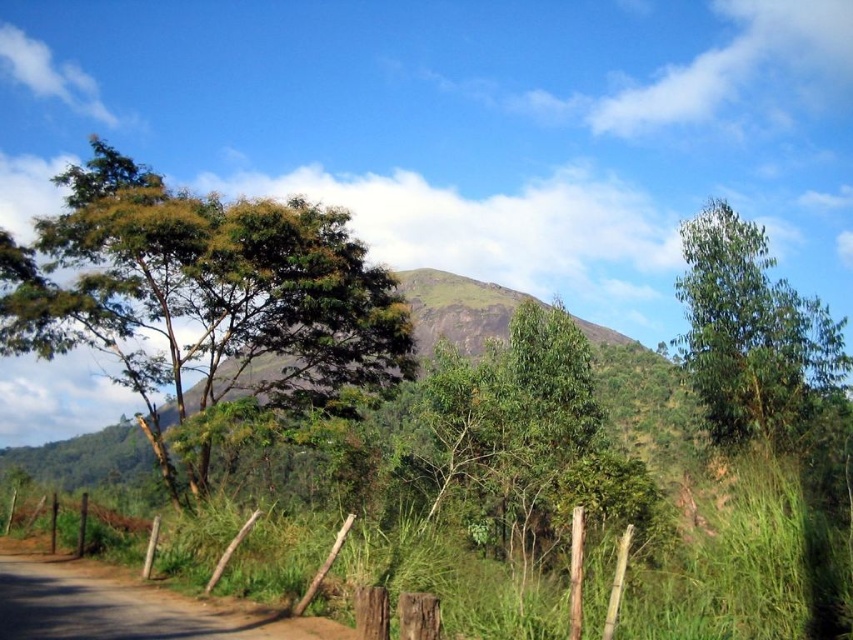
Does point (48, 621) lie behind point (119, 588)?

No, it is in front of (119, 588).

Does point (402, 618) come in front of point (55, 580)?

Yes, it is in front of point (55, 580).

At what (x,y) coordinates should I click in order to perform the action: click on brown wooden posts at lower left. Please return your answer as a coordinate pair (x, y). The image size is (853, 640). Looking at the image, I should click on (105, 609).

Is green leafy tree at left thinner than dirt road at lower left?

No, green leafy tree at left is not thinner than dirt road at lower left.

Between green leafy tree at left and dirt road at lower left, which one has more height?

green leafy tree at left

Is point (44, 243) positioned behind point (64, 604)?

Yes, it is behind point (64, 604).

Image resolution: width=853 pixels, height=640 pixels. I want to click on green leafy tree at left, so click(x=202, y=294).

Does green leafy tree at upper right appear on the left side of dirt road at lower left?

Incorrect, green leafy tree at upper right is not on the left side of dirt road at lower left.

Measure the distance between green leafy tree at upper right and camera.

green leafy tree at upper right is 45.36 feet from camera.

Does point (805, 364) lie in front of point (32, 628)?

No, (805, 364) is behind (32, 628).

This screenshot has width=853, height=640. In order to click on green leafy tree at upper right in this screenshot , I will do `click(752, 337)`.